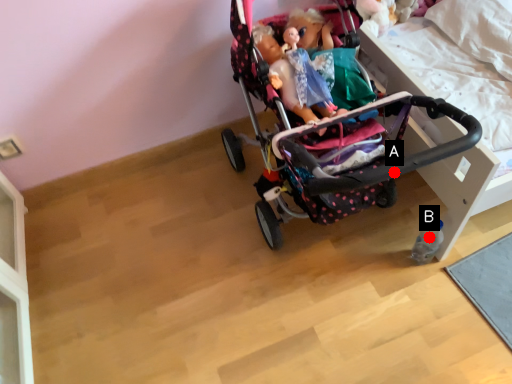
Question: Two points are circled on the image, labeled by A and B beside each circle. Which point is closer to the camera?

Choices:
 (A) A is closer
 (B) B is closer

Answer: (A)